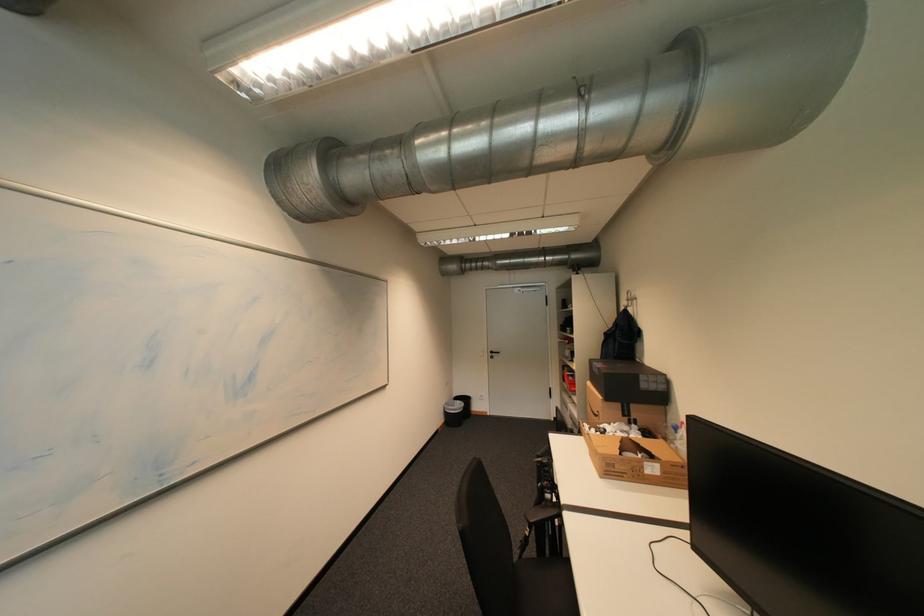
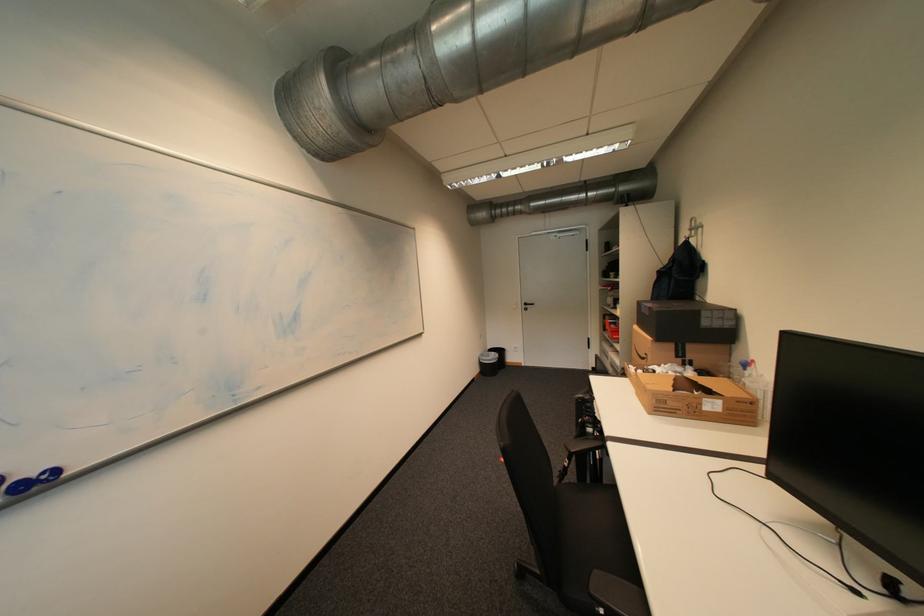
Question: What movement of the cameraman would produce the second image?

Choices:
 (A) Left
 (B) Right
 (C) Forward
 (D) Backward

Answer: (C)